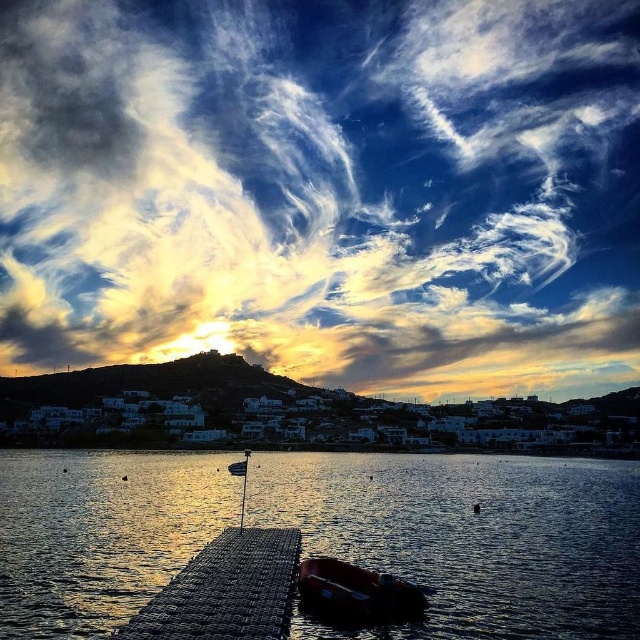
Question: Which point is farther from the camera taking this photo?

Choices:
 (A) (250, 529)
 (B) (529, 200)

Answer: (B)

Question: Is glistening water at dock center behind metallic red boat at lower center?

Choices:
 (A) no
 (B) yes

Answer: (A)

Question: Is cloudy sky at upper center smaller than rustic wooden dock at lower center?

Choices:
 (A) yes
 (B) no

Answer: (B)

Question: Among these points, which one is nearest to the camera?

Choices:
 (A) (276, 65)
 (B) (493, 493)
 (C) (241, 602)
 (D) (397, 598)

Answer: (C)

Question: Which of these objects is positioned closest to the rustic wooden dock at lower center?

Choices:
 (A) cloudy sky at upper center
 (B) metallic red boat at lower center
 (C) glistening water at dock center

Answer: (B)

Question: Is cloudy sky at upper center to the right of rustic wooden dock at lower center from the viewer's perspective?

Choices:
 (A) no
 (B) yes

Answer: (A)